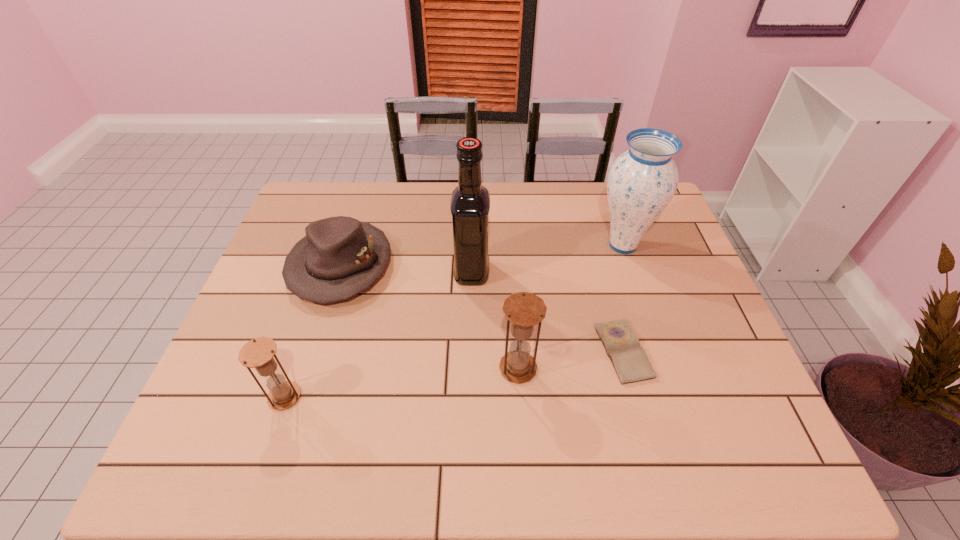
Locate an element on the screen. The image size is (960, 540). the third shortest object is located at coordinates (258, 353).

Find the location of a particular element. This screenshot has height=540, width=960. the left hourglass is located at coordinates (258, 353).

The image size is (960, 540). Find the location of `the fourth object from left to right`. the fourth object from left to right is located at coordinates (524, 310).

At what (x,y) coordinates should I click in order to perform the action: click on the third tallest object. Please return your answer as a coordinate pair (x, y). Looking at the image, I should click on pos(524,310).

Where is `the fifth tallest object`? This screenshot has height=540, width=960. the fifth tallest object is located at coordinates point(339,257).

Find the location of a particular element. This screenshot has height=540, width=960. vase is located at coordinates (642, 181).

You are a GUI agent. You are given a task and a screenshot of the screen. Output one action in this format:
    pyautogui.click(x=<x>, y=<y>)
    Task: Click on the third object from left to right
    
    Given the screenshot: What is the action you would take?
    pyautogui.click(x=470, y=201)

This screenshot has width=960, height=540. I want to click on diary, so (x=630, y=361).

Locate an element on the screen. blank space located on the back of the left hourglass is located at coordinates (316, 303).

Locate an element on the screen. vacant space located 0.220m on the left of the right hourglass is located at coordinates (406, 368).